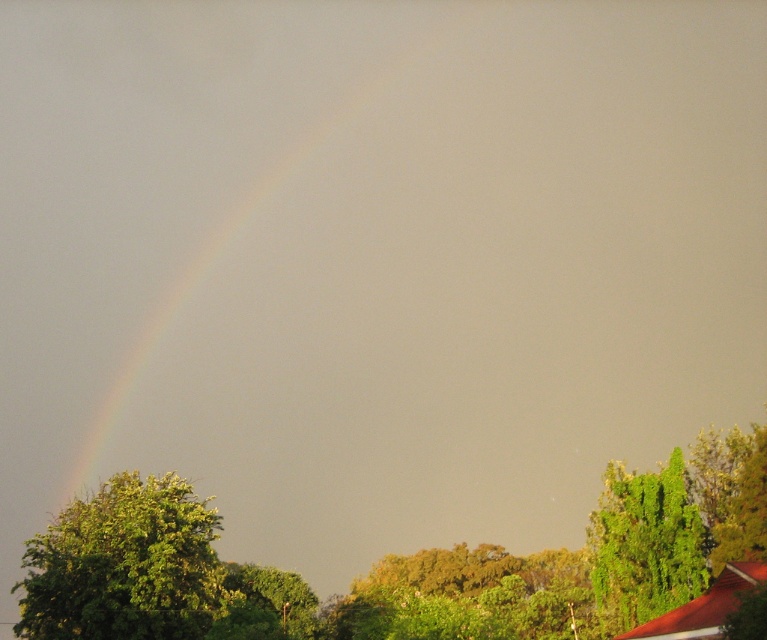
Is rainbow at upper left thinner than green leafy tree at center?

No, rainbow at upper left is not thinner than green leafy tree at center.

Is rainbow at upper left to the right of green leafy tree at center from the viewer's perspective?

In fact, rainbow at upper left is to the left of green leafy tree at center.

The image size is (767, 640). What are the coordinates of `rainbow at upper left` in the screenshot? It's located at (189, 172).

Find the location of a particular element. The height and width of the screenshot is (640, 767). rainbow at upper left is located at coordinates click(189, 172).

You are a GUI agent. You are given a task and a screenshot of the screen. Output one action in this format:
    pyautogui.click(x=<x>, y=<y>)
    Task: Click on the green leafy tree at lower left
    The width and height of the screenshot is (767, 640).
    Given the screenshot: What is the action you would take?
    pyautogui.click(x=123, y=564)

Does point (35, 611) come behind point (262, 577)?

No.

Is point (203, 561) closer to viewer compared to point (298, 612)?

Yes, it is in front of point (298, 612).

Locate an element on the screen. The width and height of the screenshot is (767, 640). green leafy tree at lower left is located at coordinates (123, 564).

Who is lower down, green leafy tree at right or green leafy tree at center?

green leafy tree at center

Is green leafy tree at right wider than green leafy tree at center?

In fact, green leafy tree at right might be narrower than green leafy tree at center.

Which is in front, point (611, 474) or point (226, 582)?

Point (611, 474) is in front.

This screenshot has height=640, width=767. In order to click on green leafy tree at right in this screenshot , I will do `click(644, 545)`.